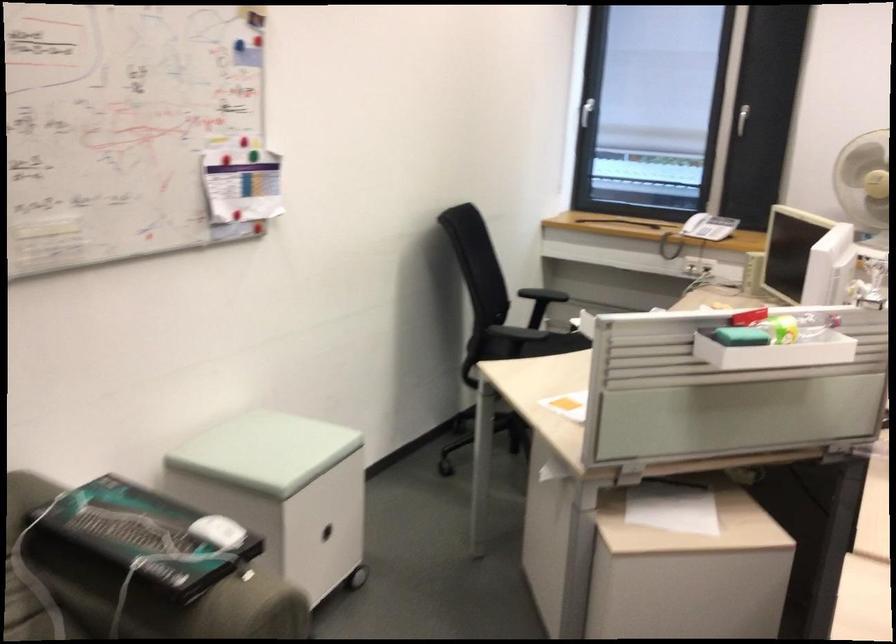
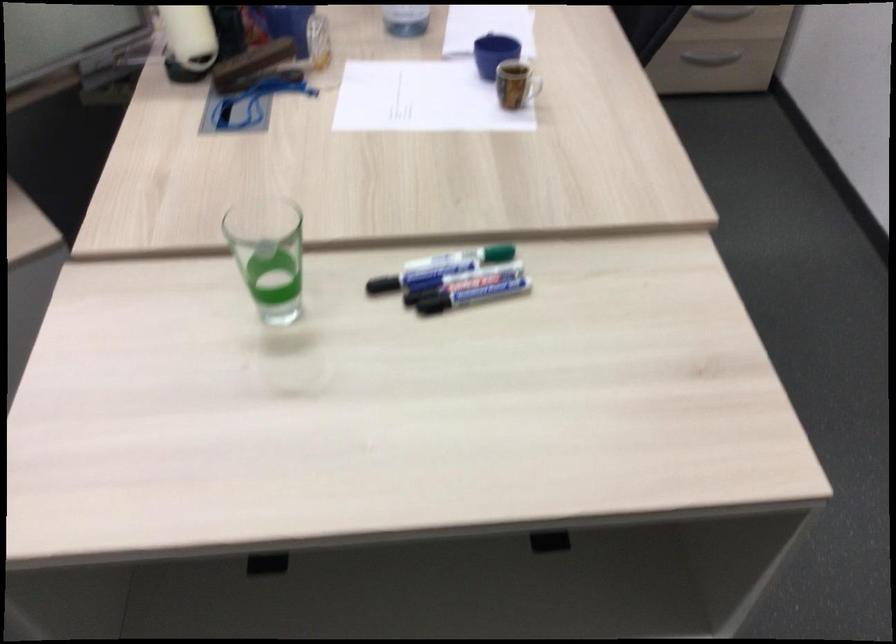
First-person continuous shooting, in which direction is the camera rotating?

The camera rotated toward right-down.